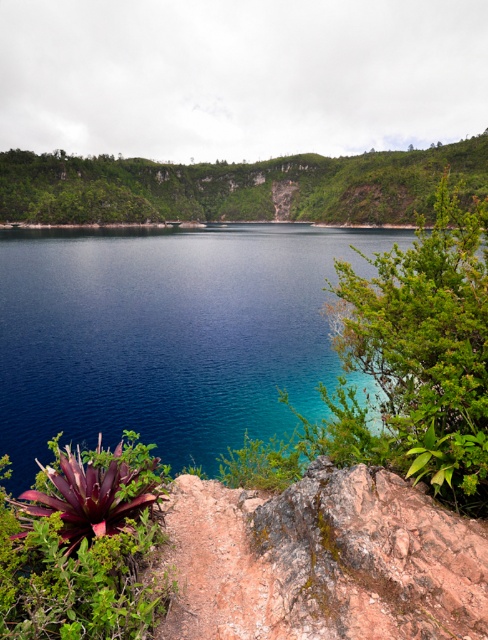
Question: In this image, where is blue water at center located relative to green leafy hillside at upper center?

Choices:
 (A) left
 (B) right

Answer: (B)

Question: Is green leafy hillside at upper center above leathery purple bromeliad at lower left?

Choices:
 (A) yes
 (B) no

Answer: (A)

Question: Which object appears farthest from the camera in this image?

Choices:
 (A) blue water at center
 (B) green leafy hillside at upper center
 (C) leathery purple bromeliad at lower left

Answer: (B)

Question: Does blue water at center lie in front of green leafy hillside at upper center?

Choices:
 (A) no
 (B) yes

Answer: (B)

Question: Which object is closer to the camera taking this photo?

Choices:
 (A) blue water at center
 (B) green leafy hillside at upper center

Answer: (A)

Question: Which of the following is the farthest from the observer?

Choices:
 (A) (183, 307)
 (B) (46, 538)
 (C) (208, 164)

Answer: (C)